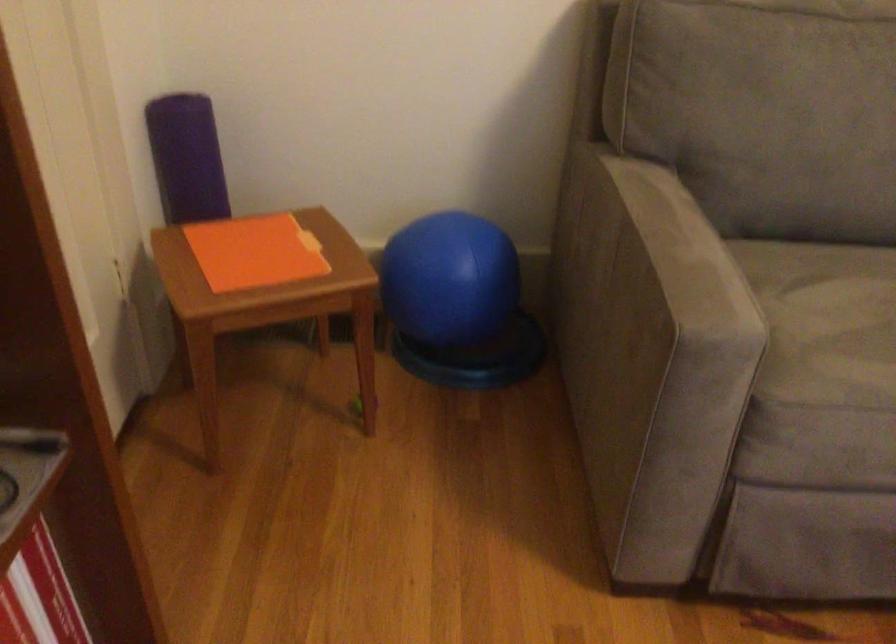
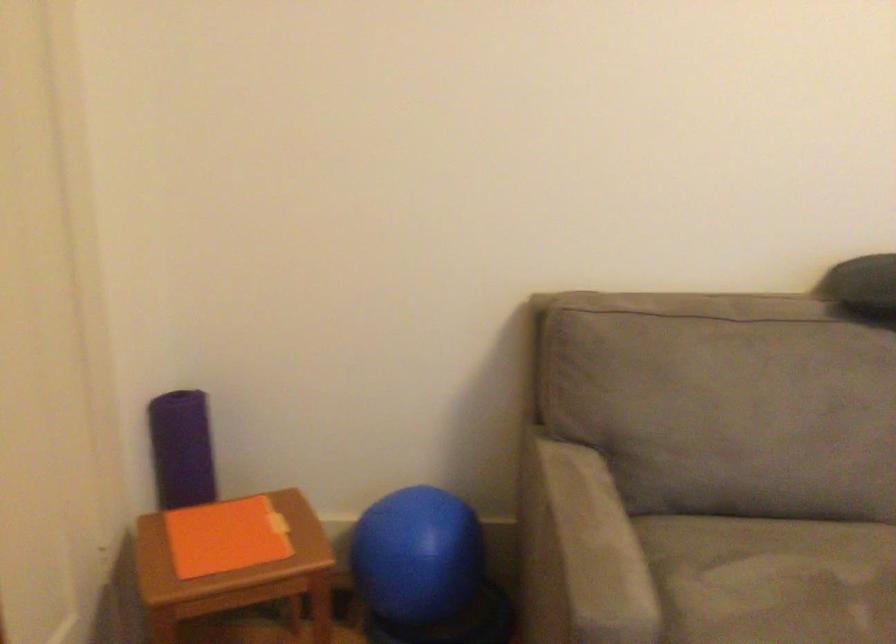
Question: The first image is from the beginning of the video and the second image is from the end. How did the camera likely rotate when shooting the video?

Choices:
 (A) Left
 (B) Right
 (C) Up
 (D) Down

Answer: (C)